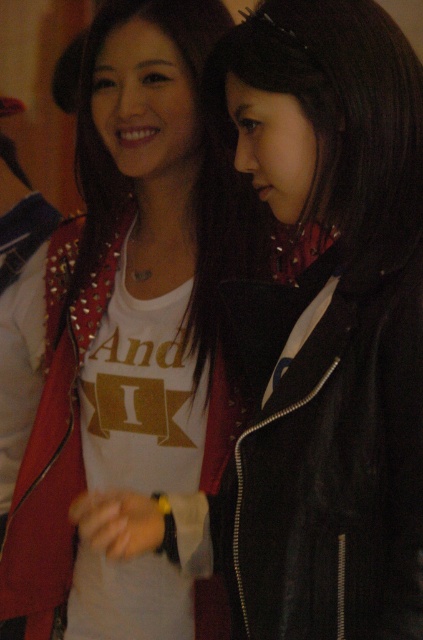
Between black leather jacket at center and studded leather jacket at center, which one appears on the right side from the viewer's perspective?

Positioned to the right is black leather jacket at center.

Based on the photo, is black leather jacket at center below studded leather jacket at center?

Indeed, black leather jacket at center is positioned under studded leather jacket at center.

Find the location of a particular element. black leather jacket at center is located at coordinates (324, 456).

Between matte studded jacket at center and studded leather jacket at center, which one appears on the left side from the viewer's perspective?

Positioned to the left is matte studded jacket at center.

Who is more forward, (165, 397) or (96, 136)?

Point (165, 397) is in front.

Is point (172, 480) in front of point (110, 188)?

Yes, point (172, 480) is in front of point (110, 188).

Locate an element on the screen. The width and height of the screenshot is (423, 640). matte studded jacket at center is located at coordinates pos(118,339).

Who is more forward, (x=118, y=552) or (x=266, y=541)?

Point (x=266, y=541)

Identify the location of matte studded jacket at center. This screenshot has width=423, height=640. (118, 339).

Who is more distant from viewer, (167, 284) or (320, 352)?

The point (167, 284) is more distant.

At what (x,y) coordinates should I click in order to perform the action: click on matte studded jacket at center. Please return your answer as a coordinate pair (x, y). The height and width of the screenshot is (640, 423). Looking at the image, I should click on (118, 339).